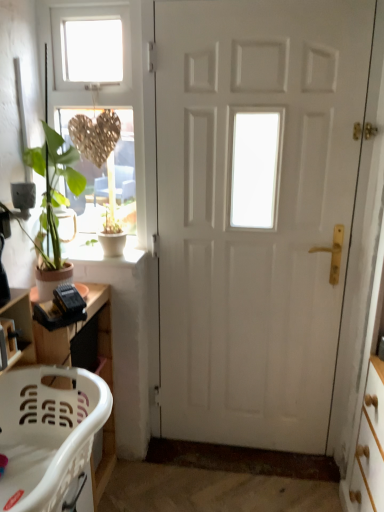
Question: Is white matte pot at window aimed at matte gold heart at upper left?

Choices:
 (A) no
 (B) yes

Answer: (A)

Question: Can you confirm if white matte pot at window is positioned to the left of matte gold heart at upper left?

Choices:
 (A) yes
 (B) no

Answer: (B)

Question: Is white matte pot at window wider than matte gold heart at upper left?

Choices:
 (A) yes
 (B) no

Answer: (A)

Question: Can you confirm if white matte pot at window is bigger than matte gold heart at upper left?

Choices:
 (A) no
 (B) yes

Answer: (A)

Question: From a real-world perspective, is white matte pot at window under matte gold heart at upper left?

Choices:
 (A) no
 (B) yes

Answer: (B)

Question: Considering the relative sizes of white matte pot at window and matte gold heart at upper left in the image provided, is white matte pot at window thinner than matte gold heart at upper left?

Choices:
 (A) yes
 (B) no

Answer: (B)

Question: Could white matte door at center be considered to be inside matte gold heart at upper left?

Choices:
 (A) yes
 (B) no

Answer: (B)

Question: From a real-world perspective, is matte gold heart at upper left located higher than white matte door at center?

Choices:
 (A) no
 (B) yes

Answer: (B)

Question: Considering the relative sizes of matte gold heart at upper left and white matte door at center in the image provided, is matte gold heart at upper left shorter than white matte door at center?

Choices:
 (A) no
 (B) yes

Answer: (B)

Question: Are matte gold heart at upper left and white matte door at center located far from each other?

Choices:
 (A) yes
 (B) no

Answer: (B)

Question: From the image's perspective, is matte gold heart at upper left on top of white matte door at center?

Choices:
 (A) no
 (B) yes

Answer: (B)

Question: Does matte gold heart at upper left turn towards white matte door at center?

Choices:
 (A) no
 (B) yes

Answer: (A)

Question: Does white matte door at center appear on the right side of white concrete window sill at lower left?

Choices:
 (A) yes
 (B) no

Answer: (A)